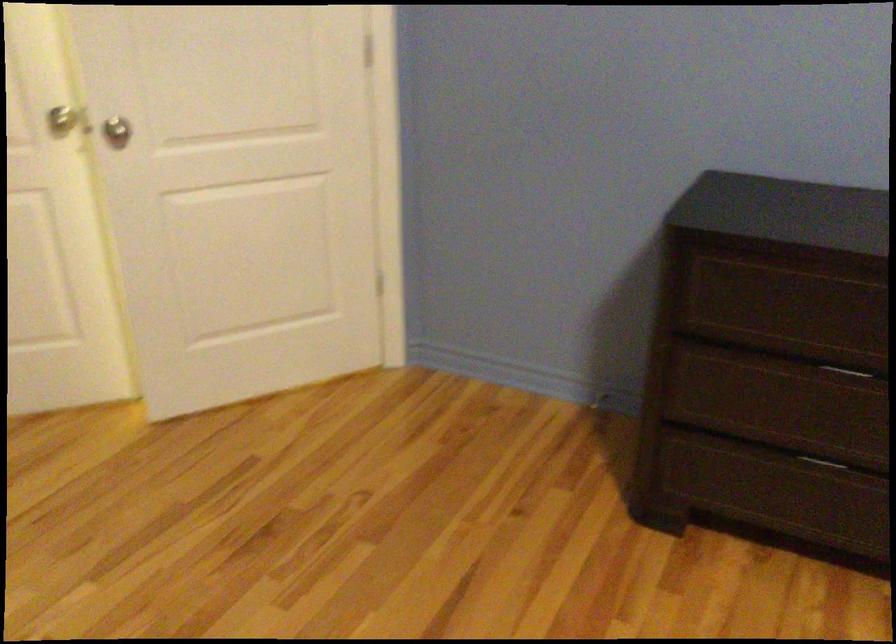
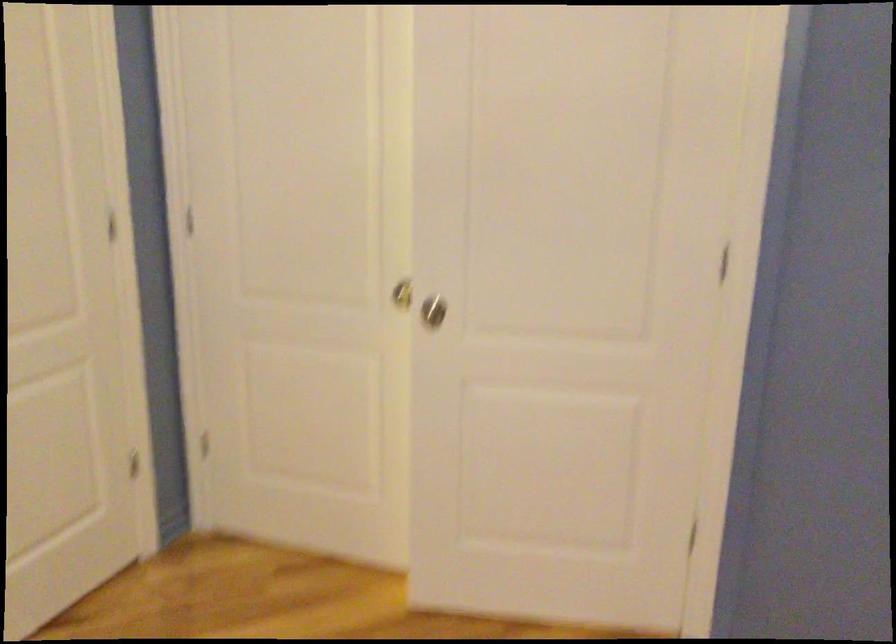
Question: How did the camera likely rotate?

Choices:
 (A) Left
 (B) Right
 (C) Up
 (D) Down

Answer: (A)